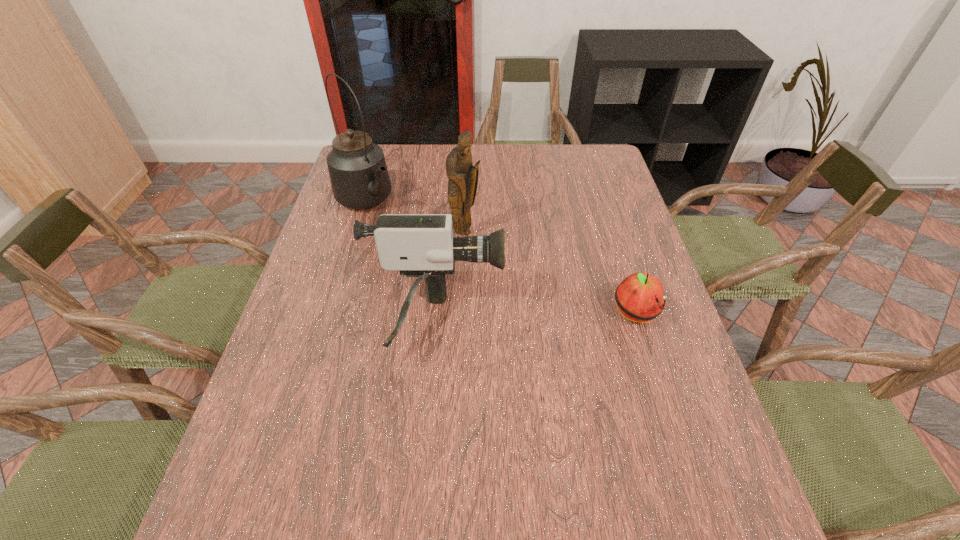
Locate an element on the screen. The width and height of the screenshot is (960, 540). free region located 0.140m spout on the tallest object is located at coordinates (413, 238).

The height and width of the screenshot is (540, 960). I want to click on vacant position located 0.320m on the front-facing side of the second farthest object, so click(553, 307).

You are a GUI agent. You are given a task and a screenshot of the screen. Output one action in this format:
    pyautogui.click(x=<x>, y=<y>)
    Task: Click on the free space located 0.200m on the front-facing side of the second farthest object
    
    Given the screenshot: What is the action you would take?
    pyautogui.click(x=520, y=279)

Where is `vacant point located on the front-facing side of the second farthest object`? The image size is (960, 540). vacant point located on the front-facing side of the second farthest object is located at coordinates (541, 297).

You are a GUI agent. You are given a task and a screenshot of the screen. Output one action in this format:
    pyautogui.click(x=<x>, y=<y>)
    Task: Click on the object at the far edge
    Image resolution: width=960 pixels, height=540 pixels.
    Given the screenshot: What is the action you would take?
    pyautogui.click(x=358, y=172)

Find the location of `object that is at the left edge`. object that is at the left edge is located at coordinates (358, 172).

Identify the location of object present at the right edge. Image resolution: width=960 pixels, height=540 pixels. (640, 297).

The image size is (960, 540). In order to click on object at the far left corner in this screenshot , I will do `click(358, 172)`.

You are a GUI agent. You are given a task and a screenshot of the screen. Output one action in this format:
    pyautogui.click(x=<x>, y=<y>)
    Task: Click on the free space at the far edge of the desktop
    This screenshot has width=960, height=540.
    Given the screenshot: What is the action you would take?
    pyautogui.click(x=503, y=163)

In the image, there is a desktop. Identify the location of vacant space at the near edge. (343, 440).